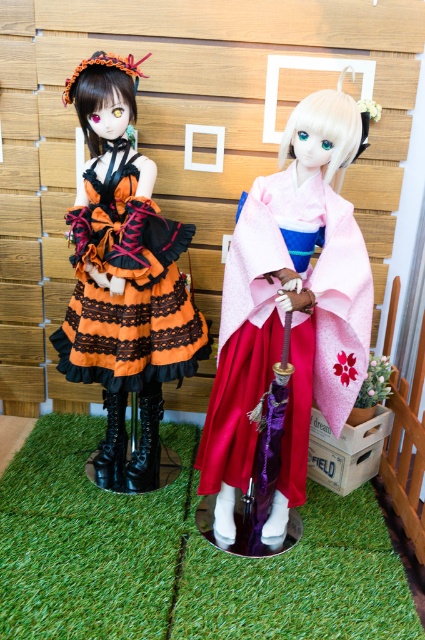
You are a visitor standing 6 feet away from the display. Can you comfortably reach the pink satin kimono at center without moving closer?

The pink satin kimono at center is 5.77 feet away from the viewer, so yes, you can comfortably reach it without moving closer since you are standing 6 feet away.

You are a customer in a doll store and want to buy the pink satin kimono at center and the orange satin dress at left. You notice that one of them is placed lower than the other. Which doll is positioned lower in the display?

The pink satin kimono at center is positioned lower than the orange satin dress at left.

You are a store employee arranging dolls in a display. You have two dolls in front of you, one wearing a pink satin kimono at center and the other wearing an orange satin dress at left. You need to place them on a shelf that can only accommodate one doll at a time. Which doll should you choose to fit better on the shelf if the shelf has limited width?

The pink satin kimono at center has a smaller width compared to the orange satin dress at left, so it would fit better on the shelf with limited width.